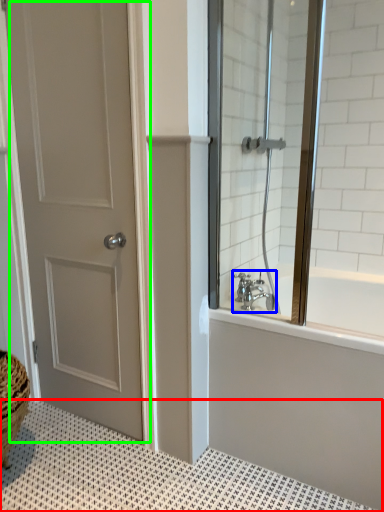
Question: Considering the real-world distances, which object is farthest from bath mat (highlighted by a red box)? tap (highlighted by a blue box) or door (highlighted by a green box)?

Choices:
 (A) tap
 (B) door

Answer: (A)